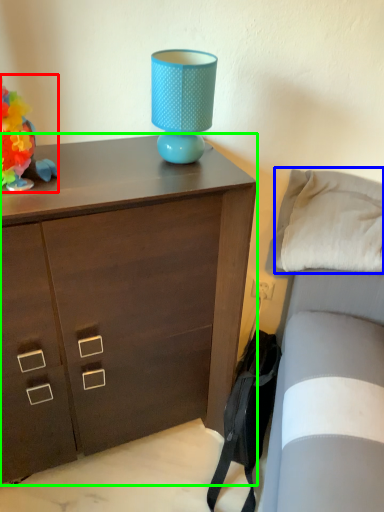
Question: Based on their relative distances, which object is nearer to toy (highlighted by a red box)? Choose from pillow (highlighted by a blue box) and chest of drawers (highlighted by a green box).

Choices:
 (A) pillow
 (B) chest of drawers

Answer: (B)